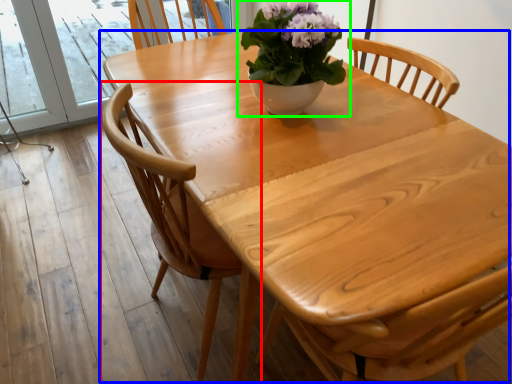
Question: Estimate the real-world distances between objects in this image. Which object is closer to chair (highlighted by a red box), kitchen & dining room table (highlighted by a blue box) or houseplant (highlighted by a green box)?

Choices:
 (A) kitchen & dining room table
 (B) houseplant

Answer: (A)